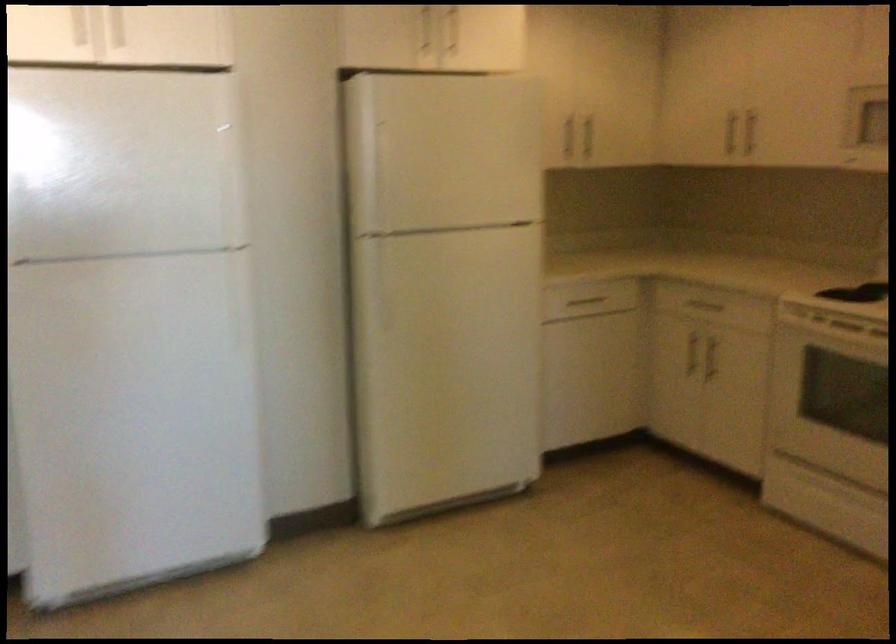
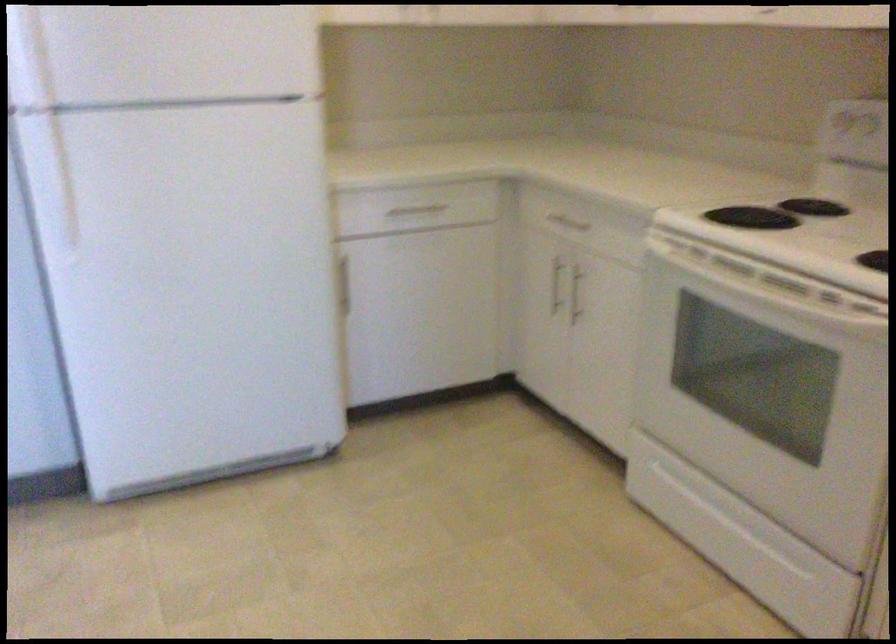
The images are taken continuously from a first-person perspective. In which direction are you moving?

The movement direction of the cameraman is right, forward.